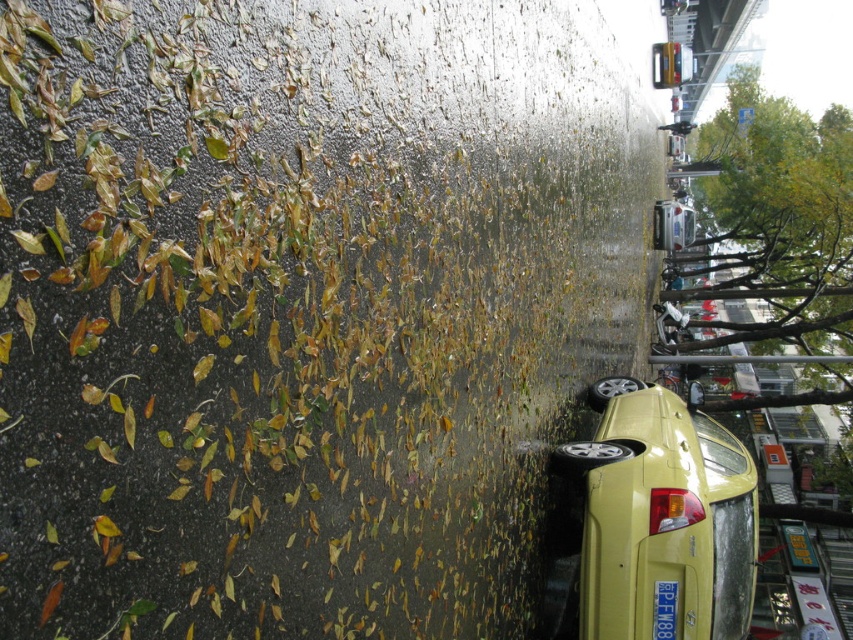
Question: Can you confirm if yellow matte car at lower right is thinner than yellow plastic license plate at lower right?

Choices:
 (A) yes
 (B) no

Answer: (B)

Question: Which point is closer to the camera taking this photo?

Choices:
 (A) (660, 593)
 (B) (715, 433)

Answer: (A)

Question: Does yellow matte car at lower right have a lesser width compared to yellow plastic license plate at lower right?

Choices:
 (A) yes
 (B) no

Answer: (B)

Question: Does yellow matte car at lower right lie in front of yellow plastic license plate at lower right?

Choices:
 (A) no
 (B) yes

Answer: (B)

Question: Among these objects, which one is nearest to the camera?

Choices:
 (A) yellow matte car at lower right
 (B) yellow plastic license plate at lower right

Answer: (A)